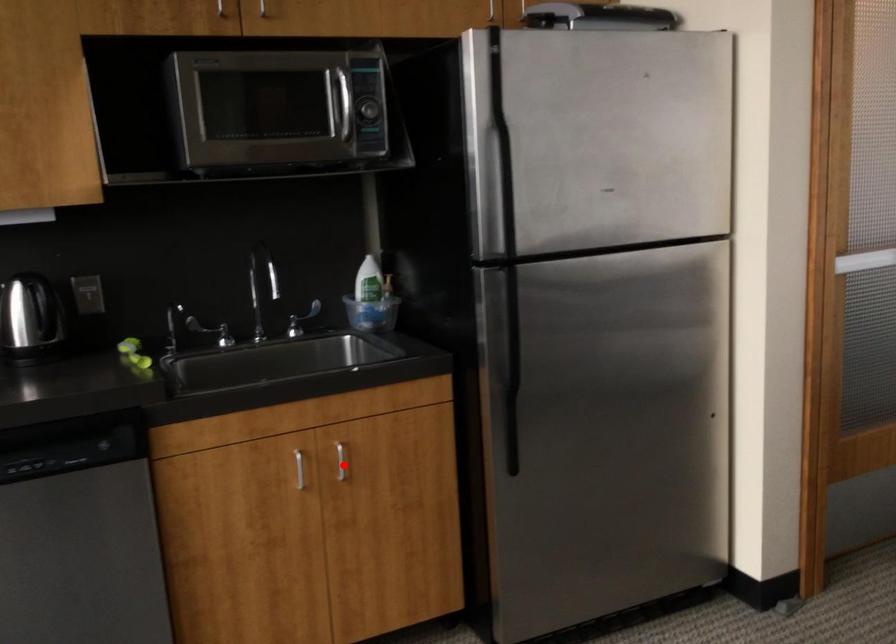
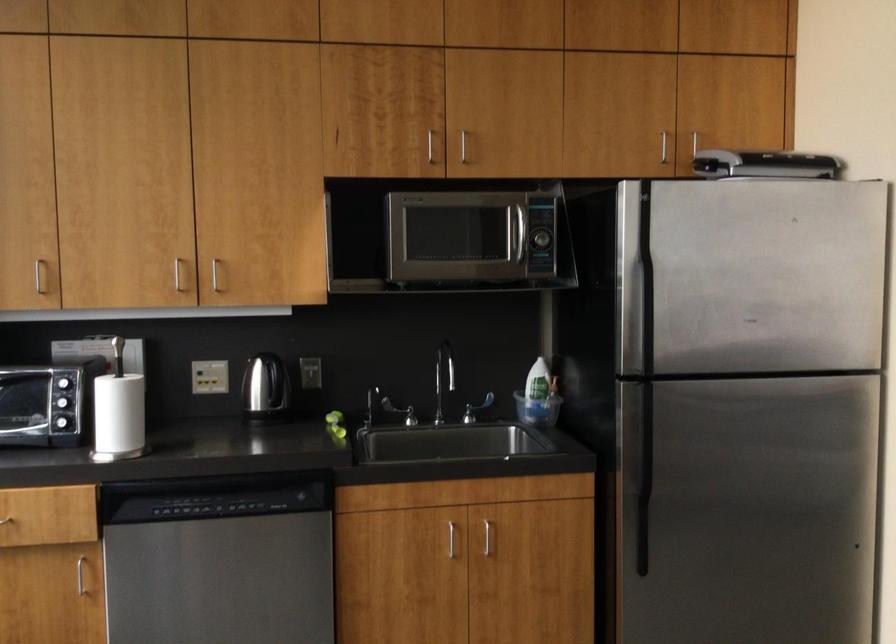
Where in the second image is the point corresponding to the highlighted location from the first image?

(490, 542)